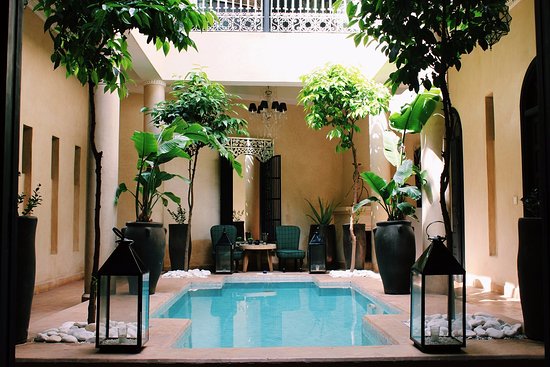
At what (x,y) coordinates should I click in order to perform the action: click on stool in between chairs. Please return your answer as a coordinate pair (x, y). This screenshot has width=550, height=367. Looking at the image, I should click on (256, 249).